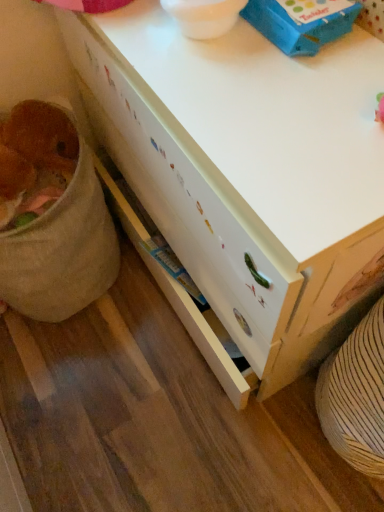
Describe the element at coordinates (33, 152) in the screenshot. I see `fuzzy brown stuffed animal at lower left` at that location.

What do you see at coordinates (248, 170) in the screenshot? I see `white wood desk at center` at bounding box center [248, 170].

Identify the location of blue cardboard box at upper center. (301, 22).

I want to click on fuzzy brown stuffed animal at lower left, so click(33, 152).

From a real-world perspective, who is located higher, blue cardboard box at upper center or white wood desk at center?

In real-world perspective, blue cardboard box at upper center is above.

Looking at the image, does blue cardboard box at upper center seem bigger or smaller compared to white wood desk at center?

In the image, blue cardboard box at upper center appears to be smaller than white wood desk at center.

Could you tell me if blue cardboard box at upper center is facing white wood desk at center?

No, blue cardboard box at upper center does not turn towards white wood desk at center.

Choose the correct answer: Is white wood desk at center inside fuzzy brown stuffed animal at lower left or outside it?

white wood desk at center is located beyond the bounds of fuzzy brown stuffed animal at lower left.

Which of these two, white wood desk at center or fuzzy brown stuffed animal at lower left, is thinner?

fuzzy brown stuffed animal at lower left.

Between point (270, 254) and point (26, 188), which one is positioned behind?

The point (26, 188) is farther from the camera.

Does white wood desk at center have a greater height compared to fuzzy brown stuffed animal at lower left?

Indeed, white wood desk at center has a greater height compared to fuzzy brown stuffed animal at lower left.

From the image's perspective, relative to blue cardboard box at upper center, is white wood desk at center above or below?

Clearly, from the image's perspective, white wood desk at center is below blue cardboard box at upper center.

How distant is white wood desk at center from blue cardboard box at upper center?

The distance of white wood desk at center from blue cardboard box at upper center is 26.49 centimeters.

You are a GUI agent. You are given a task and a screenshot of the screen. Output one action in this format:
    pyautogui.click(x=<x>, y=<y>)
    Task: Click on the desk lying on the left of blue cardboard box at upper center
    The image size is (384, 512).
    Given the screenshot: What is the action you would take?
    pyautogui.click(x=248, y=170)

Can you confirm if white wood desk at center is shorter than blue cardboard box at upper center?

No.

Considering the positions of points (48, 109) and (263, 344), is point (48, 109) closer to camera compared to point (263, 344)?

No, it is not.

Based on their sizes in the image, would you say fuzzy brown stuffed animal at lower left is bigger or smaller than white wood desk at center?

Considering their sizes, fuzzy brown stuffed animal at lower left takes up less space than white wood desk at center.

Is fuzzy brown stuffed animal at lower left thinner than white wood desk at center?

Indeed, fuzzy brown stuffed animal at lower left has a lesser width compared to white wood desk at center.

Are fuzzy brown stuffed animal at lower left and white wood desk at center beside each other?

No, fuzzy brown stuffed animal at lower left is not in contact with white wood desk at center.

Can you confirm if fuzzy brown stuffed animal at lower left is wider than blue cardboard box at upper center?

Indeed, fuzzy brown stuffed animal at lower left has a greater width compared to blue cardboard box at upper center.

From the image's perspective, is fuzzy brown stuffed animal at lower left above or below blue cardboard box at upper center?

fuzzy brown stuffed animal at lower left is below blue cardboard box at upper center.

Is fuzzy brown stuffed animal at lower left not inside blue cardboard box at upper center?

That's correct, fuzzy brown stuffed animal at lower left is outside of blue cardboard box at upper center.

Which is more to the left, fuzzy brown stuffed animal at lower left or blue cardboard box at upper center?

Positioned to the left is fuzzy brown stuffed animal at lower left.

Is blue cardboard box at upper center facing towards fuzzy brown stuffed animal at lower left?

No, blue cardboard box at upper center is not turned towards fuzzy brown stuffed animal at lower left.

Would you say blue cardboard box at upper center is inside or outside fuzzy brown stuffed animal at lower left?

blue cardboard box at upper center is not inside fuzzy brown stuffed animal at lower left, it's outside.

Identify the location of animal to the left of blue cardboard box at upper center. Image resolution: width=384 pixels, height=512 pixels. (33, 152).

Can you tell me how much blue cardboard box at upper center and fuzzy brown stuffed animal at lower left differ in facing direction?

The facing directions of blue cardboard box at upper center and fuzzy brown stuffed animal at lower left are 88.7 degrees apart.

The image size is (384, 512). In order to click on box positioned vertically above the white wood desk at center (from a real-world perspective) in this screenshot , I will do `click(301, 22)`.

This screenshot has height=512, width=384. I want to click on animal below the white wood desk at center (from the image's perspective), so click(x=33, y=152).

Looking at the image, which one is located further to blue cardboard box at upper center, fuzzy brown stuffed animal at lower left or white wood desk at center?

fuzzy brown stuffed animal at lower left is further to blue cardboard box at upper center.

Looking at the image, which one is located further to white wood desk at center, blue cardboard box at upper center or fuzzy brown stuffed animal at lower left?

fuzzy brown stuffed animal at lower left is further to white wood desk at center.

Which object lies nearer to the anchor point white wood desk at center, fuzzy brown stuffed animal at lower left or blue cardboard box at upper center?

The object closer to white wood desk at center is blue cardboard box at upper center.

Which object lies further to the anchor point fuzzy brown stuffed animal at lower left, blue cardboard box at upper center or white wood desk at center?

blue cardboard box at upper center is further to fuzzy brown stuffed animal at lower left.

Which object lies nearer to the anchor point fuzzy brown stuffed animal at lower left, white wood desk at center or blue cardboard box at upper center?

white wood desk at center.

Based on their spatial positions, is white wood desk at center or fuzzy brown stuffed animal at lower left further from blue cardboard box at upper center?

fuzzy brown stuffed animal at lower left.

This screenshot has width=384, height=512. What are the coordinates of `desk situated between fuzzy brown stuffed animal at lower left and blue cardboard box at upper center from left to right` in the screenshot? It's located at (248, 170).